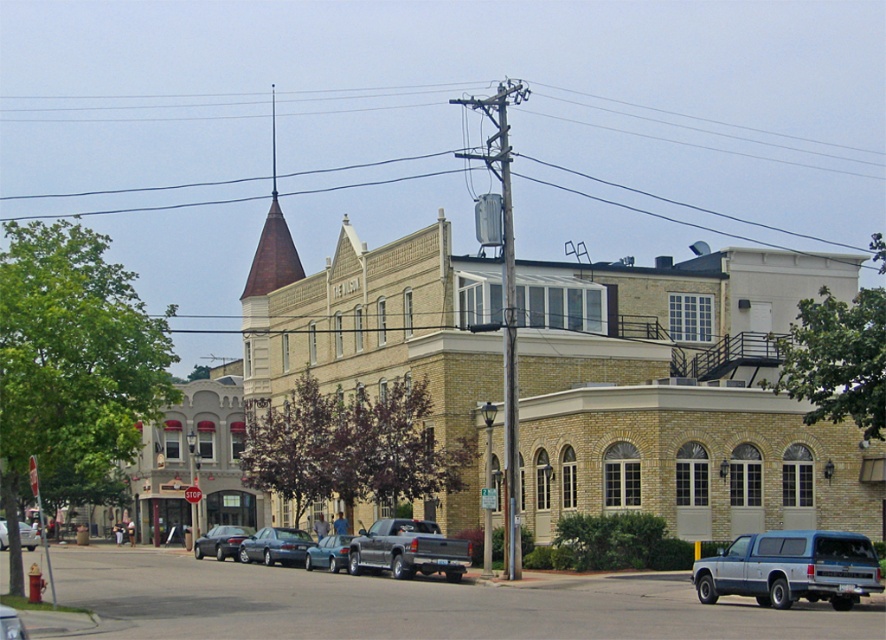
Question: Where is wooden utility pole at center located in relation to teal glossy sedan at center in the image?

Choices:
 (A) right
 (B) left

Answer: (A)

Question: Which of the following is the farthest from the observer?

Choices:
 (A) (554, 301)
 (B) (273, 541)
 (C) (0, 632)

Answer: (A)

Question: Among these objects, which one is nearest to the camera?

Choices:
 (A) teal glossy sedan at center
 (B) blue metallic truck at center
 (C) metallic gray sedan at lower left

Answer: (C)

Question: Is black wire at upper center smaller than shiny black sedan at center?

Choices:
 (A) no
 (B) yes

Answer: (A)

Question: Is blue metallic truck at center in front of metallic gray truck at center?

Choices:
 (A) yes
 (B) no

Answer: (A)

Question: Which point appears farthest from the camera in this image?

Choices:
 (A) (333, 550)
 (B) (455, 545)

Answer: (A)